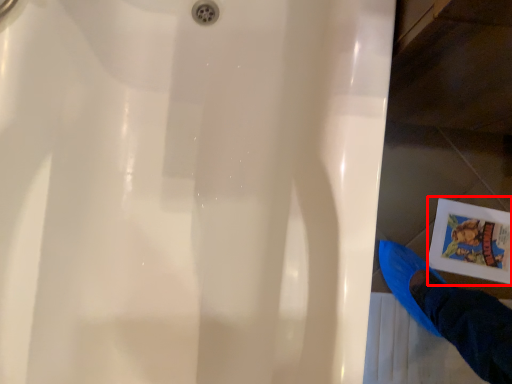
Question: From the image's perspective, what is the correct spatial relationship of comic book (annotated by the red box) in relation to person?

Choices:
 (A) below
 (B) above

Answer: (B)